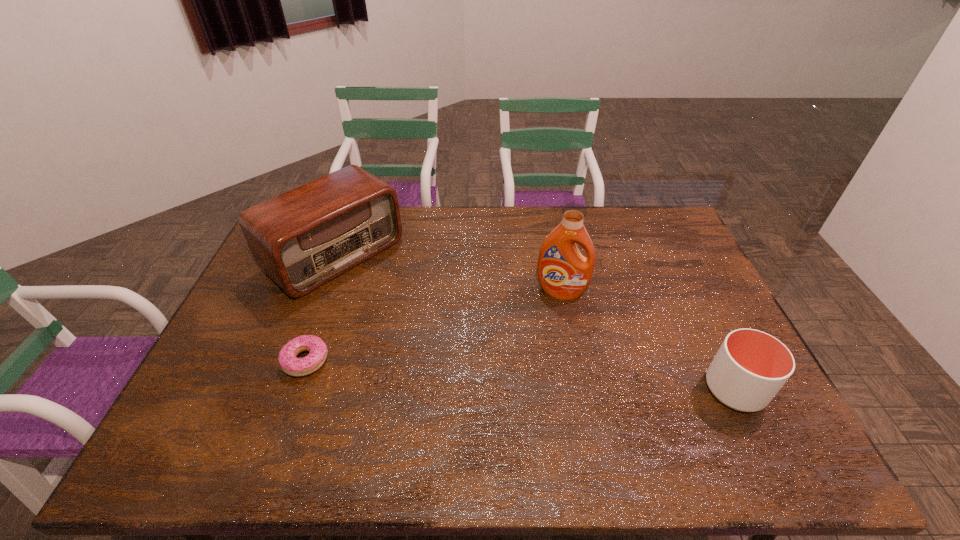
Find the location of a particular element. Image resolution: width=960 pixels, height=540 pixels. vacant area between the second object from right to left and the second shortest object is located at coordinates (648, 340).

Image resolution: width=960 pixels, height=540 pixels. I want to click on free spot between the second shortest object and the detergent, so click(x=648, y=340).

This screenshot has height=540, width=960. Find the location of `free space between the second object from right to left and the third shortest object`. free space between the second object from right to left and the third shortest object is located at coordinates (447, 273).

Find the location of a particular element. This screenshot has height=540, width=960. free spot between the radio receiver and the third tallest object is located at coordinates (535, 322).

At what (x,y) coordinates should I click in order to perform the action: click on free point between the rightmost object and the second object from right to left. Please return your answer as a coordinate pair (x, y). The width and height of the screenshot is (960, 540). Looking at the image, I should click on (648, 340).

Choose which object is the nearest neighbor to the doughnut. Please provide its 2D coordinates. Your answer should be formatted as a tuple, i.e. [(x, y)], where the tuple contains the x and y coordinates of a point satisfying the conditions above.

[(303, 238)]

Locate an element on the screen. Image resolution: width=960 pixels, height=540 pixels. the second closest object to the tallest object is located at coordinates (303, 238).

Where is `vacant space that satisfies the following two spatial constraints: 1. on the front side of the shortest object; 2. on the left side of the second tallest object`? vacant space that satisfies the following two spatial constraints: 1. on the front side of the shortest object; 2. on the left side of the second tallest object is located at coordinates click(x=296, y=360).

Identify the location of free point that satisfies the following two spatial constraints: 1. on the front side of the rightmost object; 2. on the right side of the second tallest object. (285, 389).